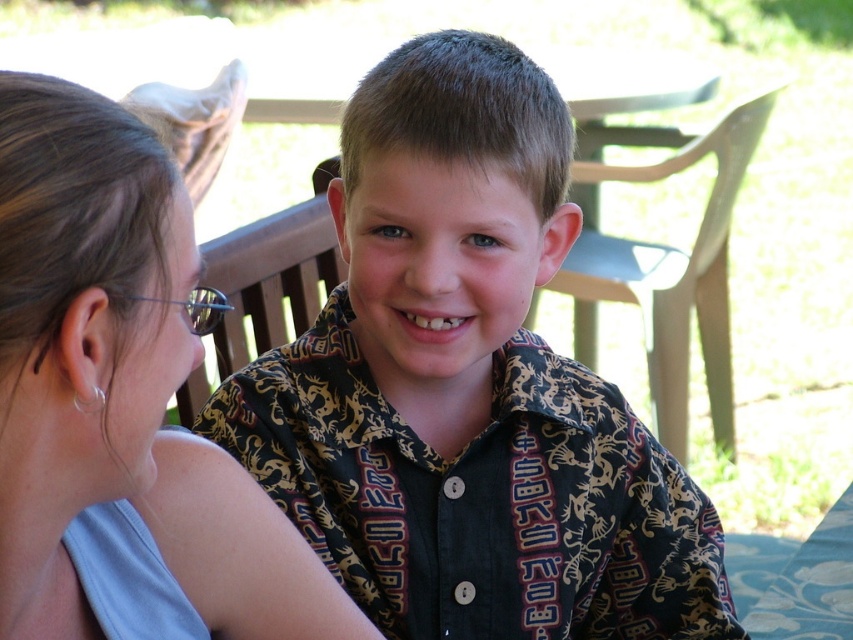
Who is positioned more to the left, printed fabric shirt at center or matte gray hair at upper left?

Positioned to the left is matte gray hair at upper left.

Based on the photo, measure the distance from printed fabric shirt at center to matte gray hair at upper left.

printed fabric shirt at center and matte gray hair at upper left are 11.85 inches apart.

Who is more forward, (x=396, y=509) or (x=128, y=513)?

Positioned in front is point (x=128, y=513).

What are the coordinates of `printed fabric shirt at center` in the screenshot? It's located at (467, 387).